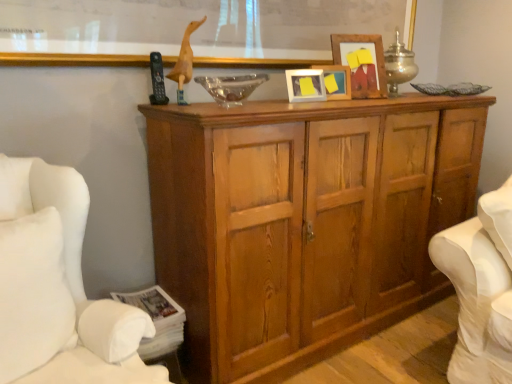
Find the location of a particular element. The image size is (512, 384). free location in front of matte wooden picture frame at center, arranged as the third picture frame when viewed from the right is located at coordinates (310, 94).